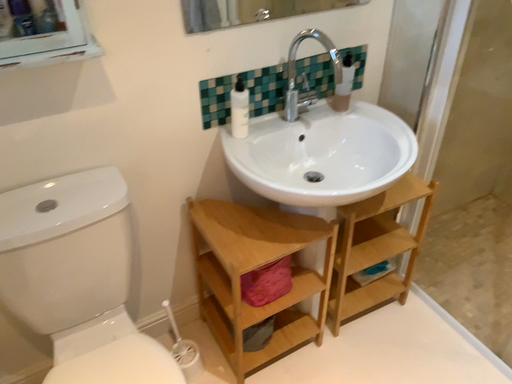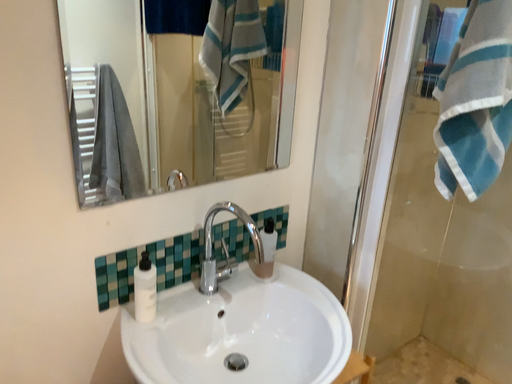
Question: Which way did the camera rotate in the video?

Choices:
 (A) rotated right
 (B) rotated left

Answer: (A)